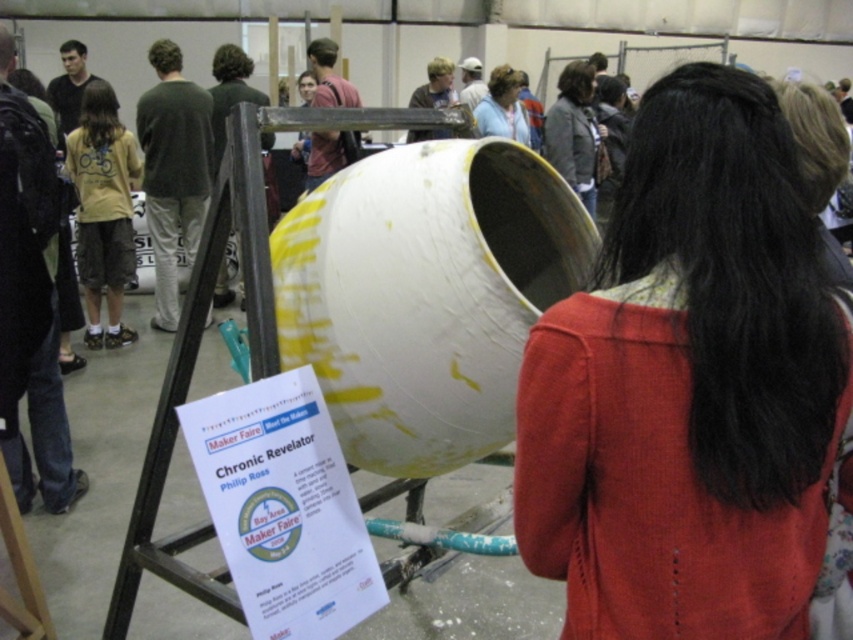
Question: Which of the following is the farthest from the observer?

Choices:
 (A) knitted red sweater at center
 (B) dark brown leather jacket at center

Answer: (B)

Question: Does knitted red sweater at center come in front of dark brown leather jacket at center?

Choices:
 (A) no
 (B) yes

Answer: (B)

Question: Which of the following is the closest to the observer?

Choices:
 (A) knitted red sweater at center
 (B) dark brown leather jacket at center

Answer: (A)

Question: Does dark brown leather jacket at center have a larger size compared to light blue fabric shirt at upper center?

Choices:
 (A) no
 (B) yes

Answer: (B)

Question: Which of the following is the farthest from the observer?

Choices:
 (A) knitted red sweater at center
 (B) dark brown leather jacket at center
 (C) light blue fabric shirt at upper center

Answer: (C)

Question: Is dark brown leather jacket at center thinner than light blue fabric shirt at upper center?

Choices:
 (A) yes
 (B) no

Answer: (B)